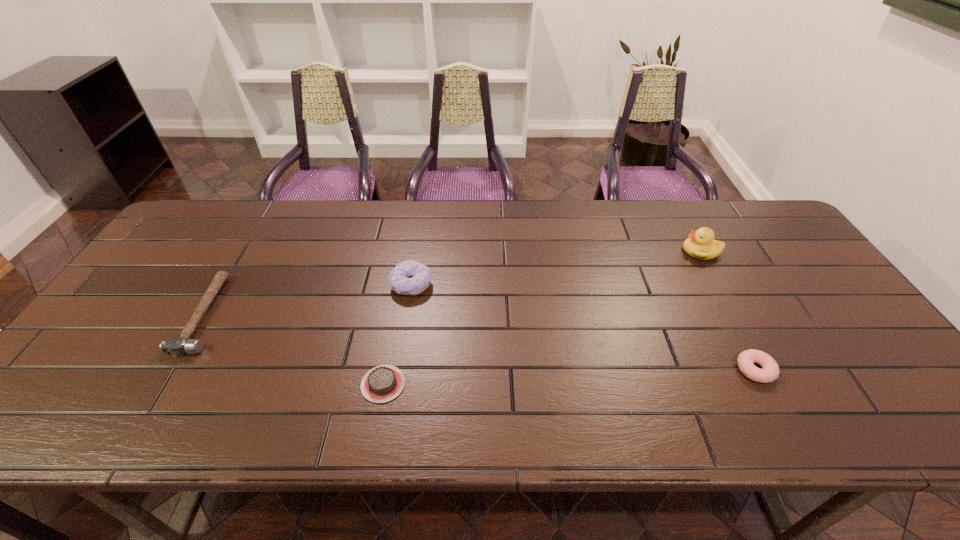
This screenshot has width=960, height=540. Identify the location of duckling. (701, 245).

At what (x,y) coordinates should I click in order to perform the action: click on the tallest object. Please return your answer as a coordinate pair (x, y). The height and width of the screenshot is (540, 960). Looking at the image, I should click on coord(701,245).

In order to click on the left doughnut in this screenshot , I will do `click(410, 277)`.

The width and height of the screenshot is (960, 540). What are the coordinates of `the taller doughnut` in the screenshot? It's located at (410, 277).

Where is `the leftmost object`? The image size is (960, 540). the leftmost object is located at coordinates click(x=178, y=346).

Identify the location of the nearer doughnut. (770, 372).

This screenshot has width=960, height=540. What are the coordinates of `the right doughnut` in the screenshot? It's located at (770, 372).

Where is `the shortest object`? This screenshot has width=960, height=540. the shortest object is located at coordinates (383, 383).

The height and width of the screenshot is (540, 960). I want to click on free space located 0.290m at the face of the farthest object, so click(587, 251).

The height and width of the screenshot is (540, 960). Identify the location of vacant region located at the face of the farthest object. (557, 251).